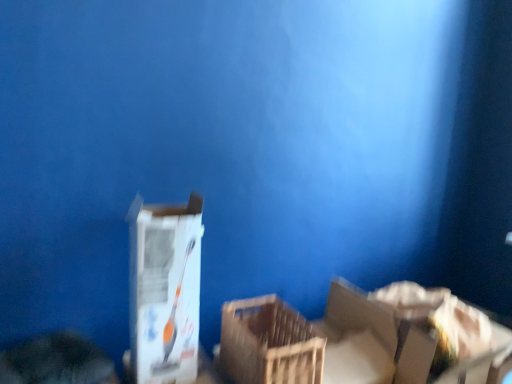
Question: From the image's perspective, is white cardboard box at lower right under white cardboard box at center?

Choices:
 (A) no
 (B) yes

Answer: (B)

Question: Does white cardboard box at lower right appear on the right side of white cardboard box at center?

Choices:
 (A) no
 (B) yes

Answer: (B)

Question: From a real-world perspective, is white cardboard box at lower right beneath white cardboard box at center?

Choices:
 (A) no
 (B) yes

Answer: (B)

Question: Is white cardboard box at lower right to the left of white cardboard box at center from the viewer's perspective?

Choices:
 (A) no
 (B) yes

Answer: (A)

Question: Is white cardboard box at center inside white cardboard box at lower right?

Choices:
 (A) no
 (B) yes

Answer: (A)

Question: Could you tell me if white cardboard box at lower right is facing white cardboard box at center?

Choices:
 (A) yes
 (B) no

Answer: (B)

Question: Considering the relative sizes of wooden crate at center and white cardboard box at lower right in the image provided, is wooden crate at center bigger than white cardboard box at lower right?

Choices:
 (A) no
 (B) yes

Answer: (A)

Question: Can you confirm if wooden crate at center is smaller than white cardboard box at lower right?

Choices:
 (A) no
 (B) yes

Answer: (B)

Question: Is wooden crate at center facing towards white cardboard box at lower right?

Choices:
 (A) yes
 (B) no

Answer: (B)

Question: Would you say white cardboard box at lower right is part of wooden crate at center's contents?

Choices:
 (A) yes
 (B) no

Answer: (B)

Question: Is wooden crate at center directly adjacent to white cardboard box at lower right?

Choices:
 (A) no
 (B) yes

Answer: (A)

Question: Does wooden crate at center lie behind white cardboard box at lower right?

Choices:
 (A) no
 (B) yes

Answer: (A)

Question: Is white cardboard box at lower right at the left side of wooden crate at center?

Choices:
 (A) no
 (B) yes

Answer: (A)